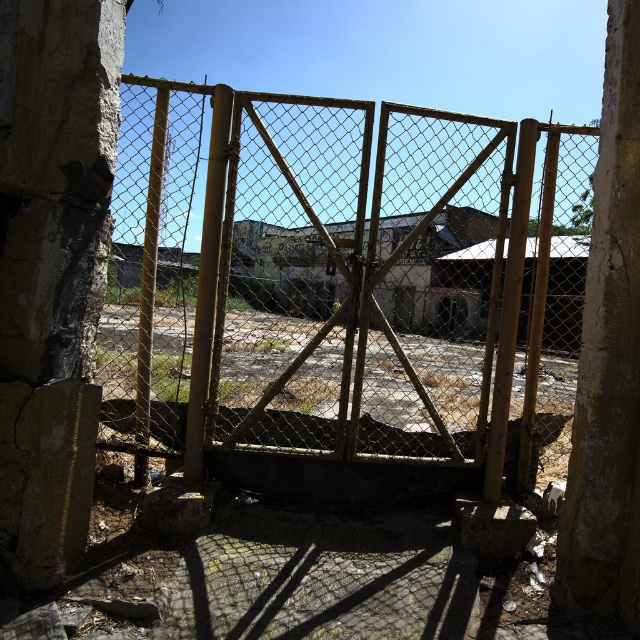
Question: Considering the real-world distances, which object is farthest from the cracked concrete pillar at left?

Choices:
 (A) cracked concrete pillar at right
 (B) yellow wire mesh gate at center

Answer: (B)

Question: Observing the image, what is the correct spatial positioning of yellow wire mesh gate at center in reference to cracked concrete pillar at left?

Choices:
 (A) right
 (B) left

Answer: (A)

Question: Which point is farther from the camera taking this photo?

Choices:
 (A) [x=4, y=81]
 (B) [x=572, y=609]

Answer: (B)

Question: Is yellow wire mesh gate at center above cracked concrete pillar at left?

Choices:
 (A) yes
 (B) no

Answer: (A)

Question: Does yellow wire mesh gate at center have a lesser width compared to cracked concrete pillar at left?

Choices:
 (A) no
 (B) yes

Answer: (A)

Question: Estimate the real-world distances between objects in this image. Which object is closer to the cracked concrete pillar at right?

Choices:
 (A) yellow wire mesh gate at center
 (B) cracked concrete pillar at left

Answer: (B)